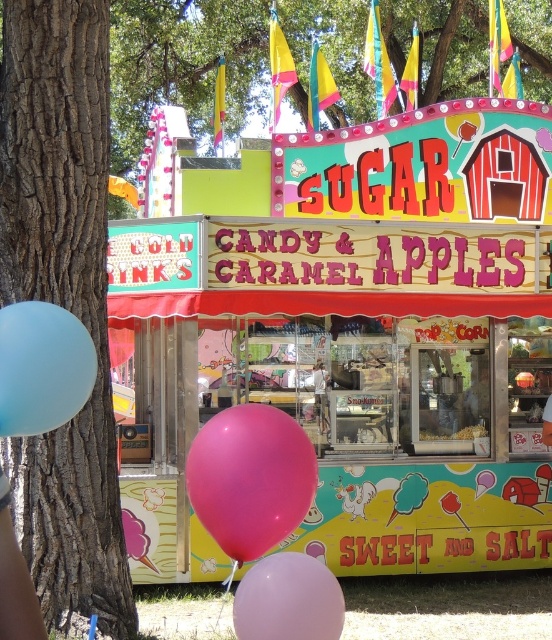
You are a customer at the Sugar Shack carnival stand and want to buy both the pink rubber balloon at lower center and the white popcorn at center. You notice that the balloon is taking up more space than the popcorn. Which object is larger in size?

The pink rubber balloon at lower center is larger in size than the white popcorn at center.

You are a customer at the Sugar Shack carnival stand. You notice a pink rubber balloon at lower center and a white popcorn at center. Which item is positioned higher from the ground?

The pink rubber balloon at lower center is located above the white popcorn at center, so it is positioned higher from the ground.